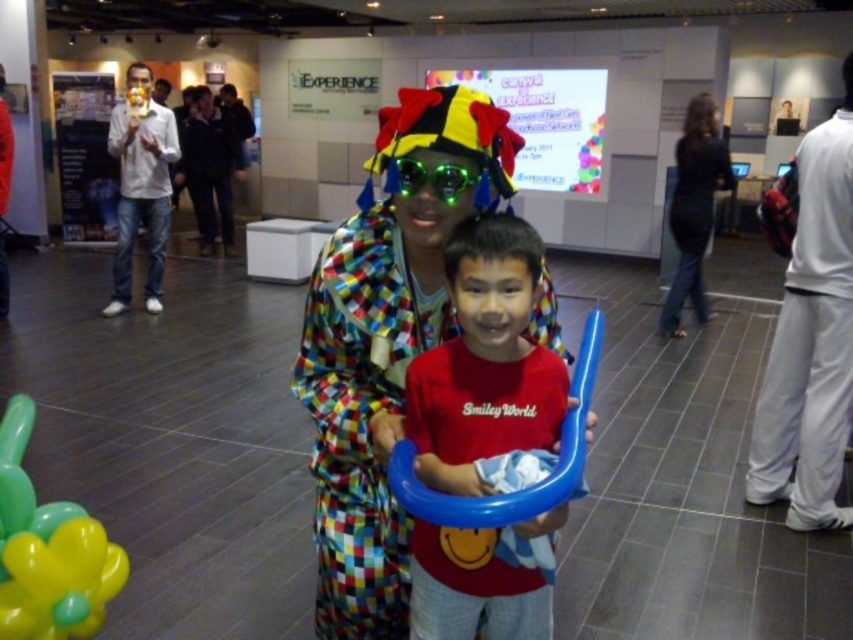
You are a photographer at the event and need to decide which clothing item to focus on for a closeup shot. Since the white fabric pants at right and the matte white shirt at left are both white, which one would you choose if you want to capture an item with a narrower width?

The white fabric pants at right is thinner than the matte white white shirt at left, so you should focus on the white fabric pants at right for a closeup shot since it has a narrower width.